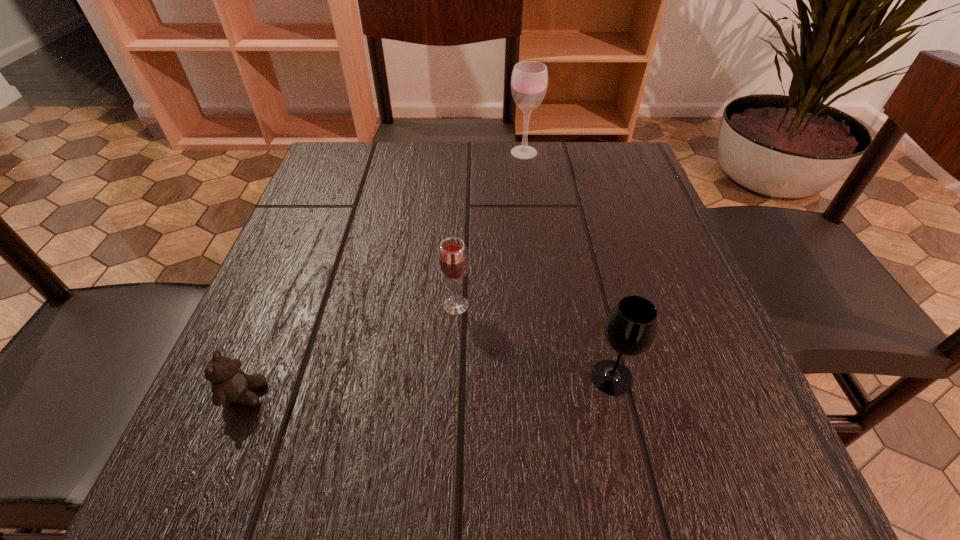
You are a GUI agent. You are given a task and a screenshot of the screen. Output one action in this format:
    pyautogui.click(x=<x>, y=<y>)
    Task: Click on the free space at the far right corner
    The image size is (960, 540).
    Given the screenshot: What is the action you would take?
    pyautogui.click(x=605, y=188)

You are a GUI agent. You are given a task and a screenshot of the screen. Output one action in this format:
    pyautogui.click(x=<x>, y=<y>)
    Task: Click on the vacant space that's between the rightmost object and the tallest wineglass
    
    Given the screenshot: What is the action you would take?
    pyautogui.click(x=567, y=265)

Locate an element on the screen. This screenshot has width=960, height=540. vacant region between the rightmost wineglass and the teddy bear is located at coordinates (428, 385).

Identify the location of free space between the teddy bear and the third nearest object. (350, 349).

Where is `free spot between the tallest object and the rightmost wineglass`? free spot between the tallest object and the rightmost wineglass is located at coordinates (567, 265).

In order to click on empty space between the third object from right to left and the shortest object in this screenshot , I will do `click(350, 349)`.

Where is `vacant space that is in between the teddy bear and the rightmost object`? vacant space that is in between the teddy bear and the rightmost object is located at coordinates (428, 385).

Identify the location of free space between the tallest object and the rightmost wineglass. (567, 265).

Image resolution: width=960 pixels, height=540 pixels. In order to click on empty location between the teddy bear and the tallest object in this screenshot , I will do `click(384, 273)`.

Image resolution: width=960 pixels, height=540 pixels. What are the coordinates of `vacant space in between the leftmost wineglass and the teddy bear` in the screenshot? It's located at (350, 349).